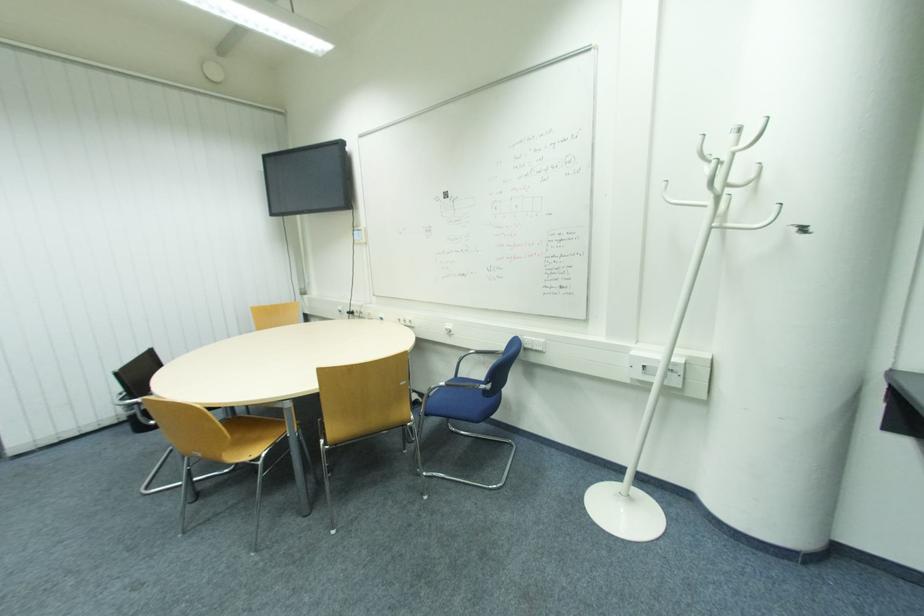
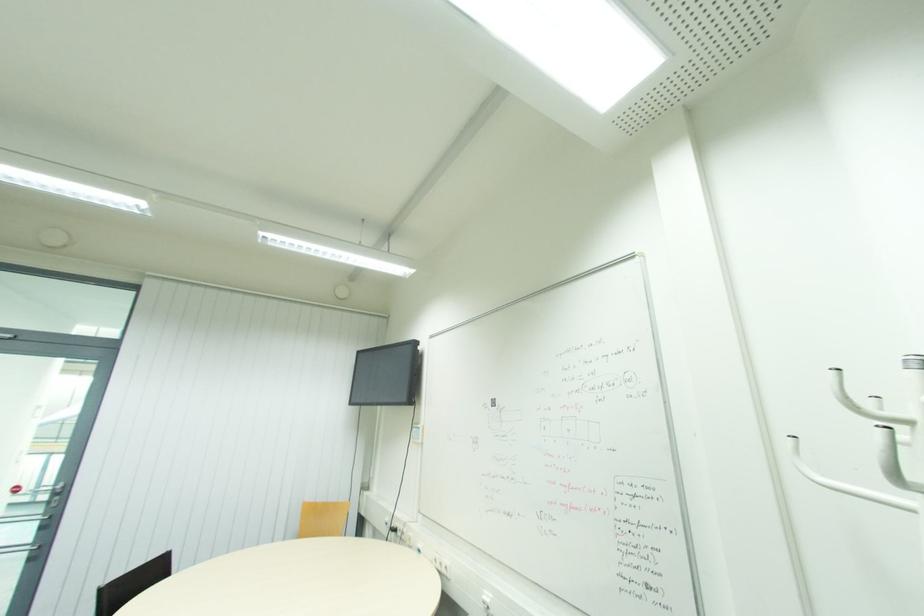
The images are taken continuously from a first-person perspective. In which direction is your viewpoint rotating?

The camera rotated toward left-up.